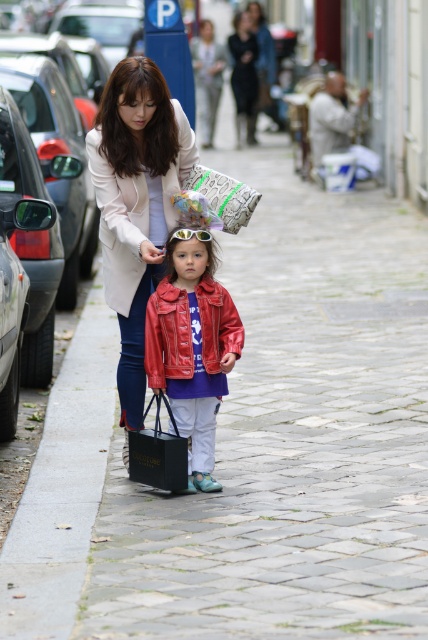
Question: Is shiny red leather jacket at center bigger than matte black car at left?

Choices:
 (A) no
 (B) yes

Answer: (A)

Question: Which point is closer to the camera?

Choices:
 (A) gray concrete curb at lower left
 (B) patterned fabric bag at center

Answer: (A)

Question: Which object is the closest to the gray concrete curb at lower left?

Choices:
 (A) patterned fabric bag at center
 (B) shiny red leather jacket at center

Answer: (B)

Question: Which point is farther to the camera?

Choices:
 (A) patterned fabric bag at center
 (B) gray concrete curb at lower left
 (C) shiny red leather jacket at center

Answer: (A)

Question: Can you confirm if gray concrete curb at lower left is bigger than matte white coat at center?

Choices:
 (A) no
 (B) yes

Answer: (A)

Question: Is matte white coat at center to the right of patterned fabric bag at center from the viewer's perspective?

Choices:
 (A) yes
 (B) no

Answer: (B)